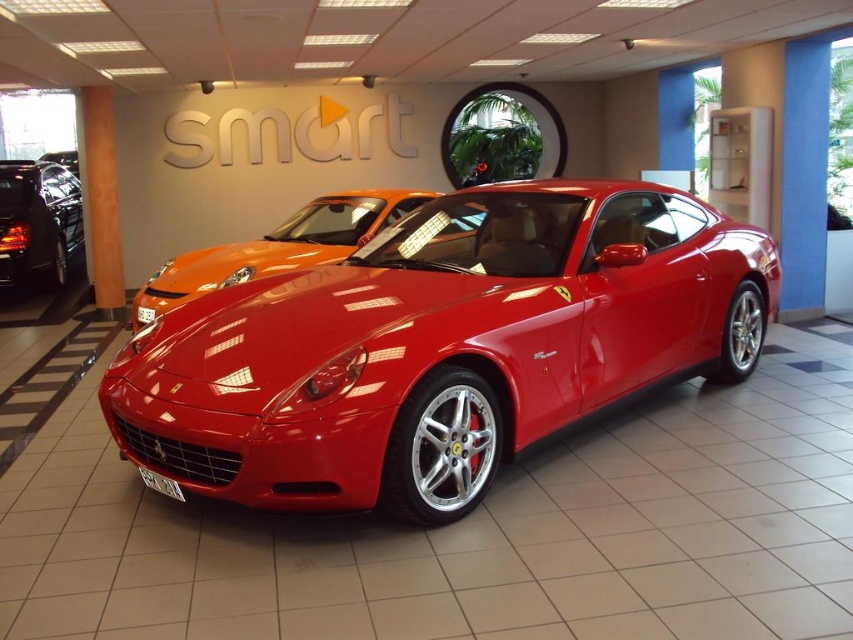
Between shiny red sports car at center and shiny red car at center, which one is positioned lower?

Positioned lower is shiny red sports car at center.

Locate an element on the screen. This screenshot has height=640, width=853. shiny red sports car at center is located at coordinates (439, 346).

Which is in front, point (15, 212) or point (67, 150)?

Positioned in front is point (15, 212).

Identify the location of glossy black car at left. Image resolution: width=853 pixels, height=640 pixels. (38, 221).

Is shiny red car at center to the left of glossy black car at left from the viewer's perspective?

In fact, shiny red car at center is to the right of glossy black car at left.

What are the coordinates of `shiny red car at center` in the screenshot? It's located at (277, 248).

In order to click on shiny red car at center in this screenshot , I will do `click(277, 248)`.